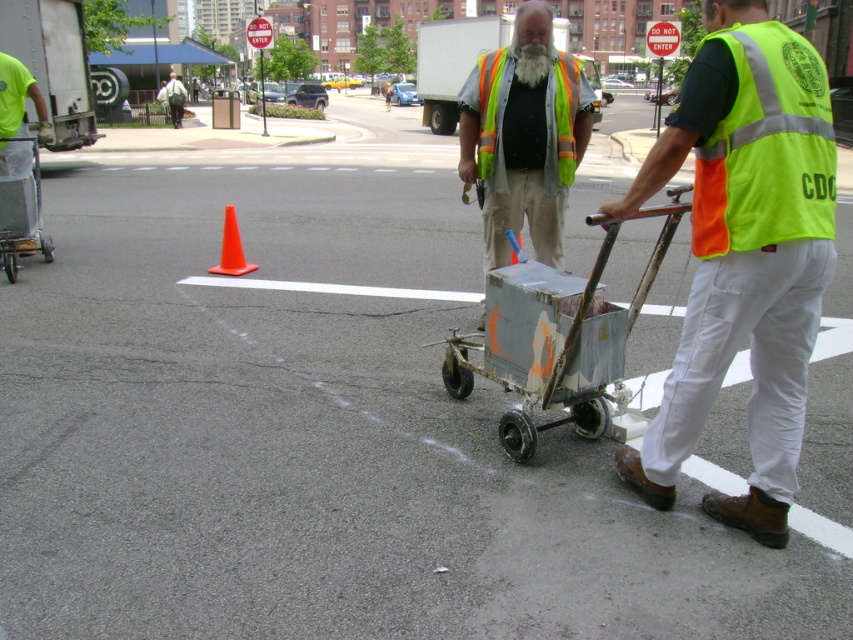
You are a pedestrian standing at the orange traffic cone near the center of the image. You see the neon yellow reflective vest at center and the green fabric backpack at upper left. Which object is closer to you?

The neon yellow reflective vest at center is closer to you because it is only 29.77 meters away from the green fabric backpack at upper left, but since you are at the cone near the center, the vest is likely closer than the backpack.